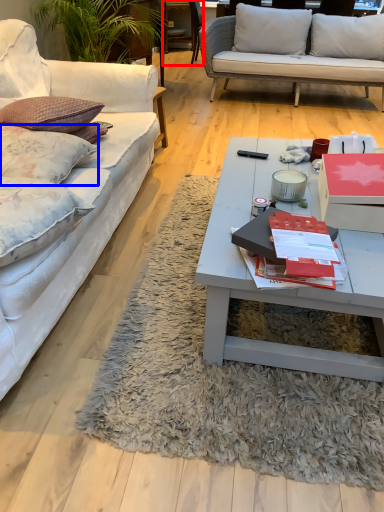
Question: Among these objects, which one is nearest to the camera, chair (highlighted by a red box) or pillow (highlighted by a blue box)?

Choices:
 (A) chair
 (B) pillow

Answer: (B)